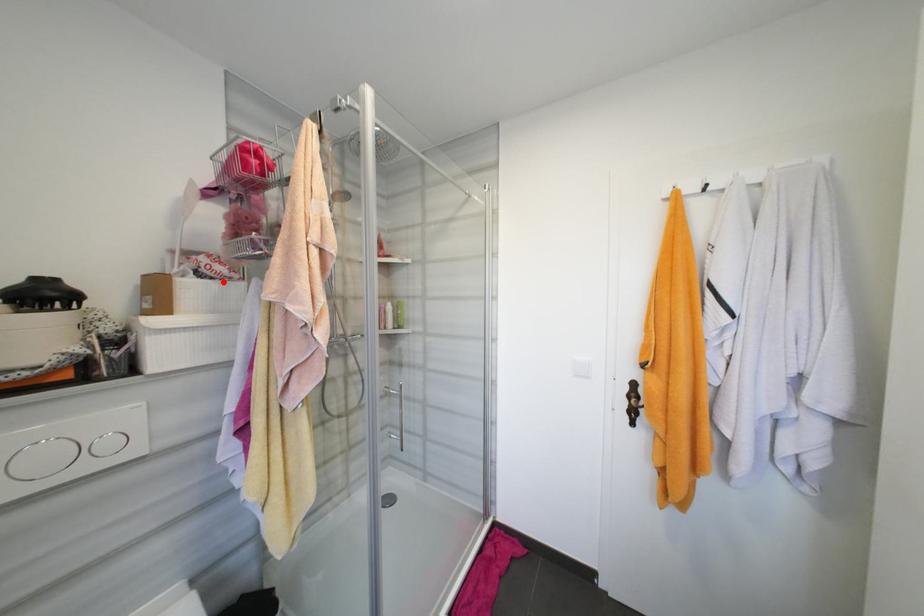
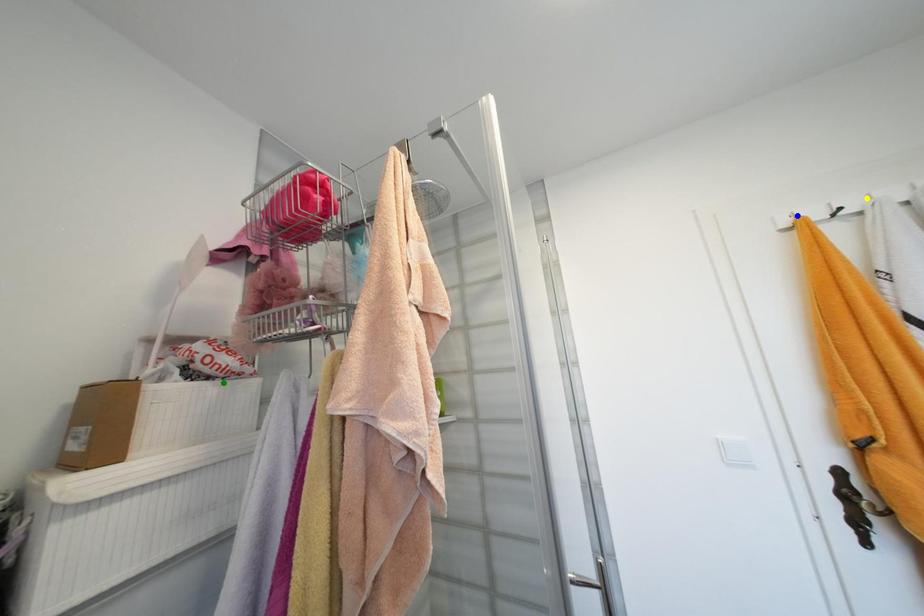
Question: I am providing you with two images of the same scene from different viewpoints. A red point is marked on the first image. You are given multiple points on the second image. Which spot in image 2 lines up with the point in image 1?

Choices:
 (A) yellow point
 (B) blue point
 (C) green point

Answer: (C)